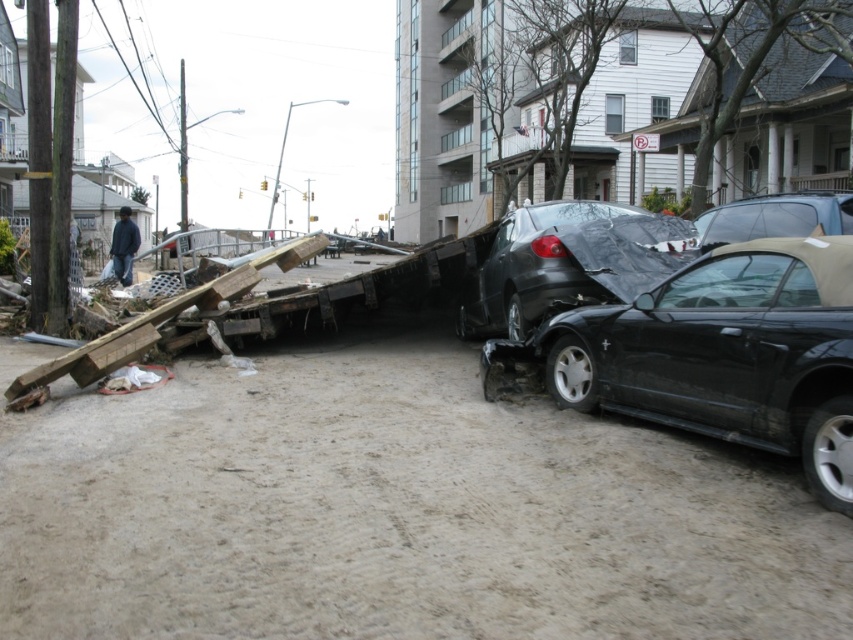
Question: Can you confirm if black matte convertible at center is thinner than black matte car at center?

Choices:
 (A) yes
 (B) no

Answer: (A)

Question: Can you confirm if black matte convertible at center is bigger than matte black convertible at center?

Choices:
 (A) no
 (B) yes

Answer: (B)

Question: Which point appears farthest from the camera in this image?

Choices:
 (A) (848, 202)
 (B) (809, 429)
 (C) (462, 314)

Answer: (C)

Question: Which object is the closest to the black matte car at center?

Choices:
 (A) matte black convertible at center
 (B) black matte convertible at center

Answer: (B)

Question: Is black matte car at center smaller than matte black convertible at center?

Choices:
 (A) no
 (B) yes

Answer: (A)

Question: Which point appears closest to the camera in this image?

Choices:
 (A) (830, 252)
 (B) (709, 237)

Answer: (A)